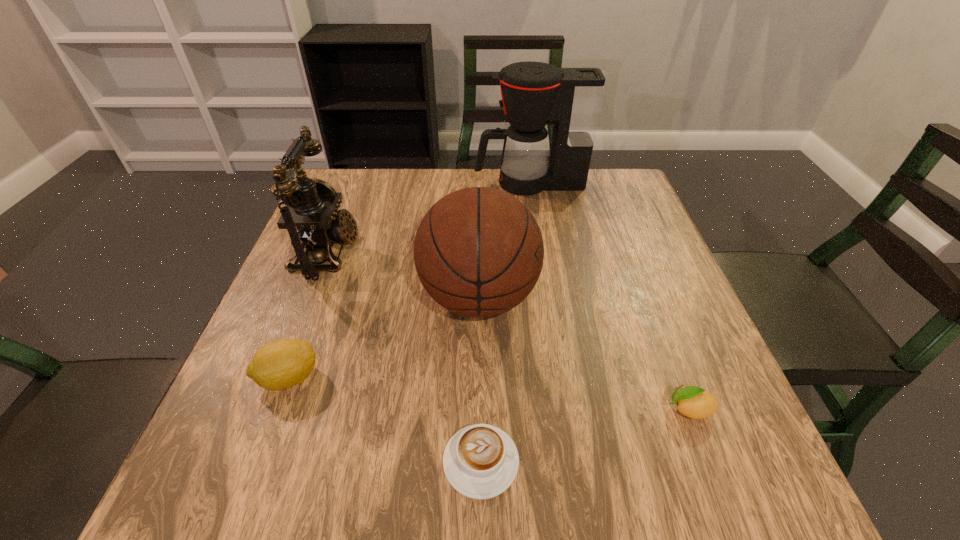
Identify which object is the nearest to the farthest object. Please provide its 2D coordinates. Your answer should be formatted as a tuple, i.e. [(x, y)], where the tuple contains the x and y coordinates of a point satisfying the conditions above.

[(478, 252)]

Select which object appears as the fourth closest to the basketball. Please provide its 2D coordinates. Your answer should be formatted as a tuple, i.e. [(x, y)], where the tuple contains the x and y coordinates of a point satisfying the conditions above.

[(694, 402)]